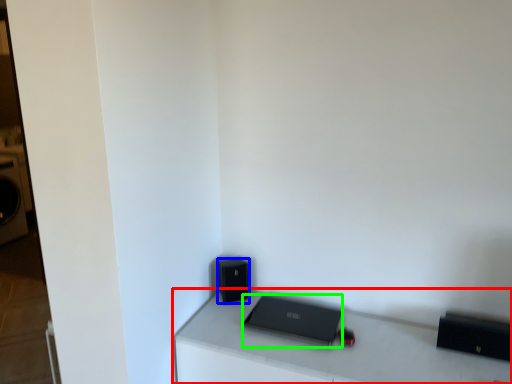
Question: Based on their relative distances, which object is farther from furniture (highlighted by a red box)? Choose from speaker (highlighted by a blue box) and laptop (highlighted by a green box).

Choices:
 (A) speaker
 (B) laptop

Answer: (A)